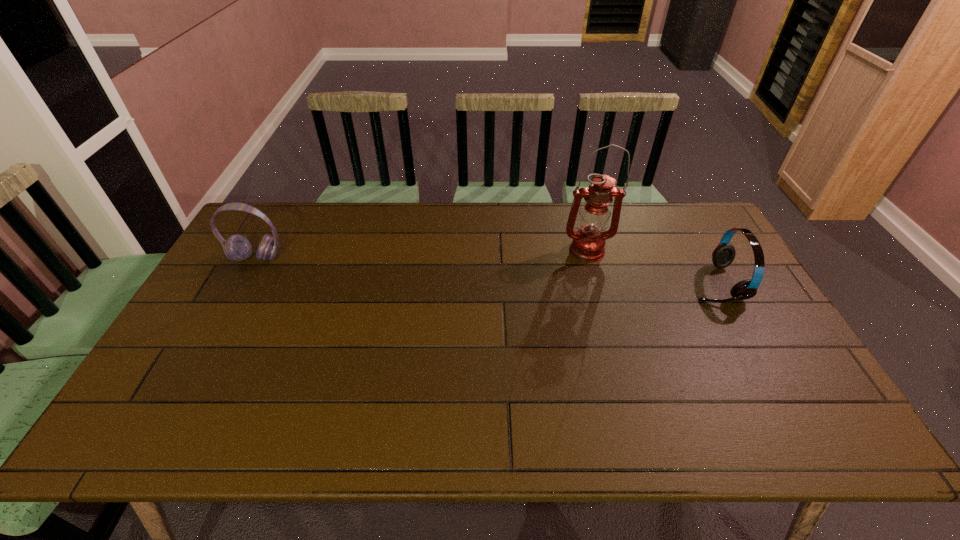
The width and height of the screenshot is (960, 540). Find the location of `the tallest object`. the tallest object is located at coordinates click(588, 243).

Locate an element on the screen. the second object from right to left is located at coordinates (588, 243).

The height and width of the screenshot is (540, 960). Find the location of `the leftmost object`. the leftmost object is located at coordinates (237, 248).

Where is `the right headset`? The width and height of the screenshot is (960, 540). the right headset is located at coordinates (723, 255).

Where is `the shorter headset`? the shorter headset is located at coordinates (723, 255).

I want to click on vacant space located on the front of the second object from left to right, so click(x=601, y=307).

Identify the location of vacant area located 0.050m on the headband and ear cups of the leftmost object. (246, 278).

What are the coordinates of `vacant region located with the microphone attached to the side of the shorter headset` in the screenshot? It's located at (593, 283).

The image size is (960, 540). Identify the location of vacant region located 0.360m with the microphone attached to the side of the shorter headset. (570, 283).

Where is `blank space located 0.310m with the microphone attached to the side of the shorter headset`? blank space located 0.310m with the microphone attached to the side of the shorter headset is located at coordinates (587, 283).